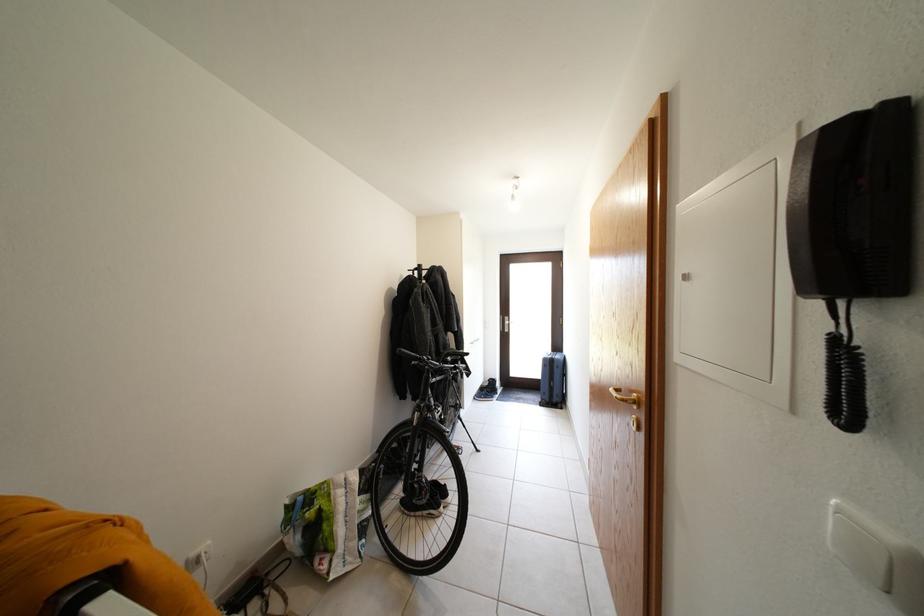
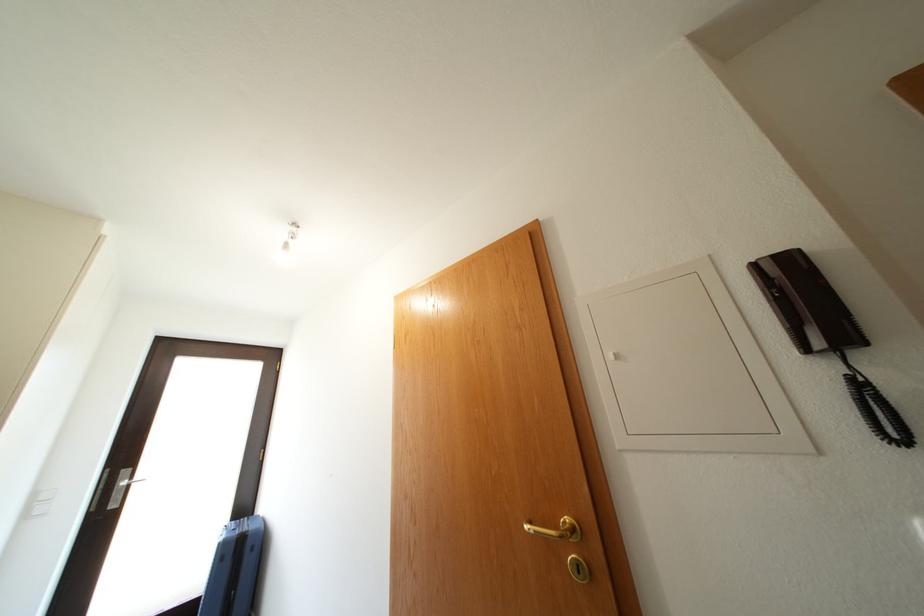
In the scene shown: First-person continuous shooting, in which direction is the camera rotating?

A: The camera's rotation is toward right-up.